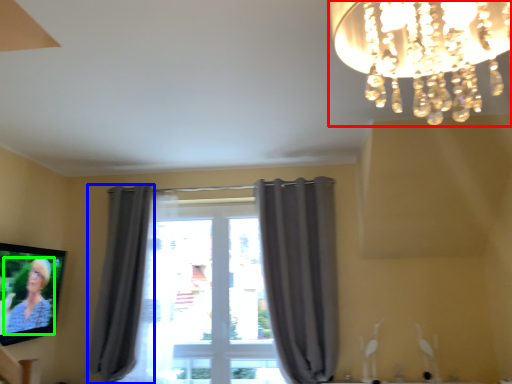
Question: Estimate the real-world distances between objects in this image. Which object is farther from lamp (highlighted by a red box), curtain (highlighted by a blue box) or person (highlighted by a green box)?

Choices:
 (A) curtain
 (B) person

Answer: (A)